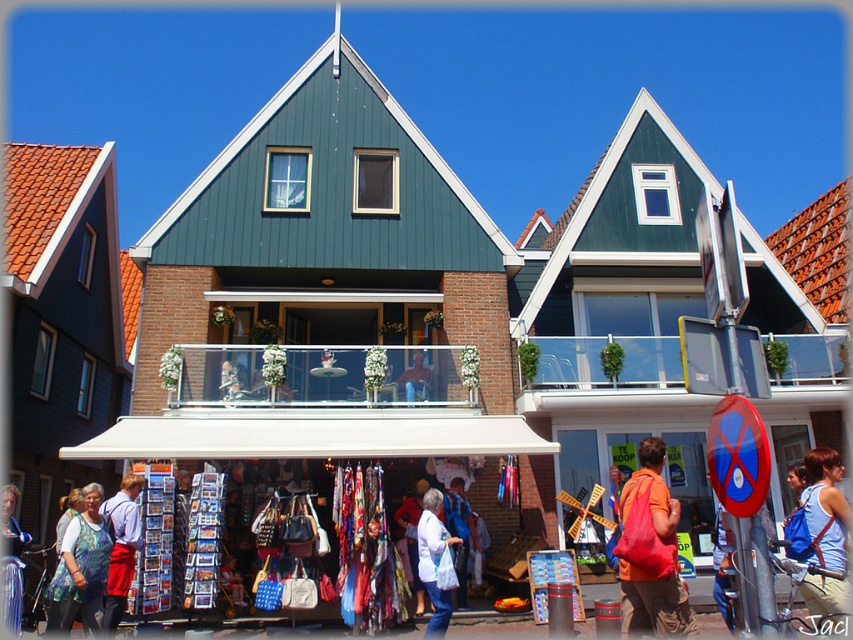
You are standing in the street scene looking at the market stall. There are two points marked on the image. Which point, point 1 at coordinates (x=73, y=602) or point 2 at (x=108, y=598), is closer to you?

Point 1 at coordinates (x=73, y=602) is closer to the viewer than point 2 at (x=108, y=598).

You are a customer at the market stall with the light colored awning. You see the matte orange backpack at center and the leather jacket at center. Which item is positioned lower?

The matte orange backpack at center is located below the leather jacket at center, so it is positioned lower.